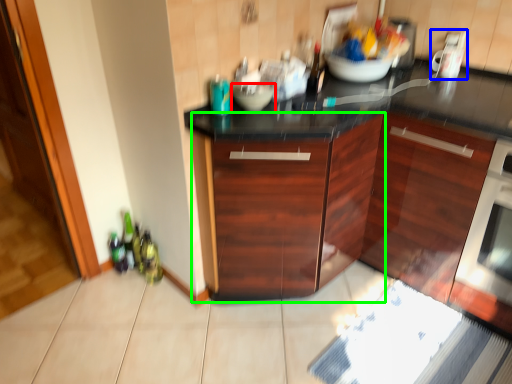
Question: Which object is positioned closest to bowl (highlighted by a red box)? Select from appliance (highlighted by a blue box) and cabinetry (highlighted by a green box).

Choices:
 (A) appliance
 (B) cabinetry

Answer: (B)